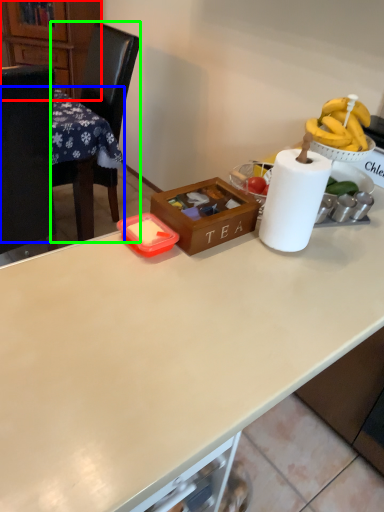
Question: Which is farther away from cabinetry (highlighted by a red box)? table (highlighted by a blue box) or chair (highlighted by a green box)?

Choices:
 (A) table
 (B) chair

Answer: (A)